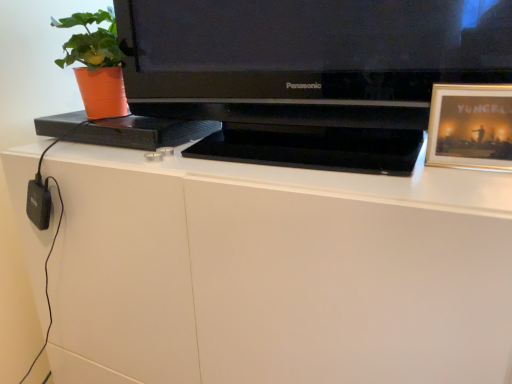
Locate an element on the screen. black glossy television at center is located at coordinates (308, 73).

Where is `white matte desk at center`? The image size is (512, 384). white matte desk at center is located at coordinates (276, 272).

Is black glossy television at center facing towards orange plastic pot at left?

No, black glossy television at center is not oriented towards orange plastic pot at left.

Relative to orange plastic pot at left, is black glossy television at center in front or behind?

black glossy television at center is in front of orange plastic pot at left.

Can you tell me how much black glossy television at center and orange plastic pot at left differ in facing direction?

The angle between the facing direction of black glossy television at center and the facing direction of orange plastic pot at left is 7.91e-05 degrees.

Between gold-framed picture at upper right and orange plastic pot at left, which one is positioned in front?

gold-framed picture at upper right is closer to the camera.

Is point (466, 140) positioned behind point (118, 51)?

No, (466, 140) is in front of (118, 51).

Could you tell me if gold-framed picture at upper right is facing orange plastic pot at left?

No, gold-framed picture at upper right is not facing towards orange plastic pot at left.

Is orange plastic pot at left oriented away from gold-framed picture at upper right?

That's not correct — orange plastic pot at left is not looking away from gold-framed picture at upper right.

How different are the orientations of orange plastic pot at left and gold-framed picture at upper right in degrees?

0.79 degrees.

Considering the positions of objects orange plastic pot at left and gold-framed picture at upper right in the image provided, who is more to the left, orange plastic pot at left or gold-framed picture at upper right?

From the viewer's perspective, orange plastic pot at left appears more on the left side.

Would you consider orange plastic pot at left to be distant from gold-framed picture at upper right?

They are positioned close to each other.

Does black glossy television at center have a greater width compared to gold-framed picture at upper right?

Yes, black glossy television at center is wider than gold-framed picture at upper right.

In terms of height, does black glossy television at center look taller or shorter compared to gold-framed picture at upper right?

Clearly, black glossy television at center is taller compared to gold-framed picture at upper right.

From a real-world perspective, does black glossy television at center stand above gold-framed picture at upper right?

Yes, from a real-world perspective, black glossy television at center is over gold-framed picture at upper right

Can gold-framed picture at upper right be found inside black glossy television at center?

Yes.

Does point (72, 23) come closer to viewer compared to point (248, 60)?

That is False.

Considering the relative sizes of orange plastic pot at left and black glossy television at center in the image provided, is orange plastic pot at left shorter than black glossy television at center?

Correct, orange plastic pot at left is not as tall as black glossy television at center.

How far apart are orange plastic pot at left and black glossy television at center?

A distance of 12.11 inches exists between orange plastic pot at left and black glossy television at center.

In the image, is orange plastic pot at left positioned in front of or behind black glossy television at center?

Clearly, orange plastic pot at left is behind black glossy television at center.

Do you think orange plastic pot at left is within white matte desk at center, or outside of it?

The correct answer is: outside.

Which is behind, orange plastic pot at left or white matte desk at center?

orange plastic pot at left is more distant.

Looking at this image, from a real-world perspective, between orange plastic pot at left and white matte desk at center, who is vertically higher?

In real-world perspective, orange plastic pot at left is above.

Is orange plastic pot at left bigger or smaller than white matte desk at center?

In the image, orange plastic pot at left appears to be smaller than white matte desk at center.

Is white matte desk at center inside the boundaries of black glossy television at center, or outside?

white matte desk at center is not inside black glossy television at center, it's outside.

From a real-world perspective, relative to black glossy television at center, is white matte desk at center vertically above or below?

white matte desk at center is below black glossy television at center.

From the image's perspective, is white matte desk at center located above black glossy television at center?

Actually, white matte desk at center appears below black glossy television at center in the image.

At what (x,y) coordinates should I click in order to perform the action: click on television directly beneath the orange plastic pot at left (from a real-world perspective). Please return your answer as a coordinate pair (x, y). The image size is (512, 384). Looking at the image, I should click on [308, 73].

The image size is (512, 384). I want to click on picture frame that appears in front of the orange plastic pot at left, so tap(470, 126).

Based on their spatial positions, is white matte desk at center or gold-framed picture at upper right closer to black glossy television at center?

white matte desk at center.

Based on their spatial positions, is orange plastic pot at left or gold-framed picture at upper right closer to black glossy television at center?

gold-framed picture at upper right.

From the image, which object appears to be farther from orange plastic pot at left, black glossy television at center or gold-framed picture at upper right?

gold-framed picture at upper right.

Based on their spatial positions, is gold-framed picture at upper right or white matte desk at center further from orange plastic pot at left?

gold-framed picture at upper right is positioned further to the anchor orange plastic pot at left.

Estimate the real-world distances between objects in this image. Which object is further from gold-framed picture at upper right, black glossy television at center or white matte desk at center?

white matte desk at center.

When comparing their distances from black glossy television at center, does gold-framed picture at upper right or orange plastic pot at left seem closer?

gold-framed picture at upper right is closer to black glossy television at center.

Looking at this image, based on their spatial positions, is orange plastic pot at left or white matte desk at center closer to black glossy television at center?

white matte desk at center.

Based on the photo, estimate the real-world distances between objects in this image. Which object is closer to gold-framed picture at upper right, orange plastic pot at left or black glossy television at center?

Based on the image, black glossy television at center appears to be nearer to gold-framed picture at upper right.

Identify the location of television between orange plastic pot at left and white matte desk at center in the vertical direction. Image resolution: width=512 pixels, height=384 pixels. (308, 73).

The image size is (512, 384). Find the location of `television between orange plastic pot at left and gold-framed picture at upper right from left to right`. television between orange plastic pot at left and gold-framed picture at upper right from left to right is located at coordinates (308, 73).

Where is `picture frame between black glossy television at center and white matte desk at center from top to bottom`? Image resolution: width=512 pixels, height=384 pixels. picture frame between black glossy television at center and white matte desk at center from top to bottom is located at coordinates (470, 126).

This screenshot has height=384, width=512. Find the location of `desk between orange plastic pot at left and gold-framed picture at upper right in the horizontal direction`. desk between orange plastic pot at left and gold-framed picture at upper right in the horizontal direction is located at coordinates [276, 272].